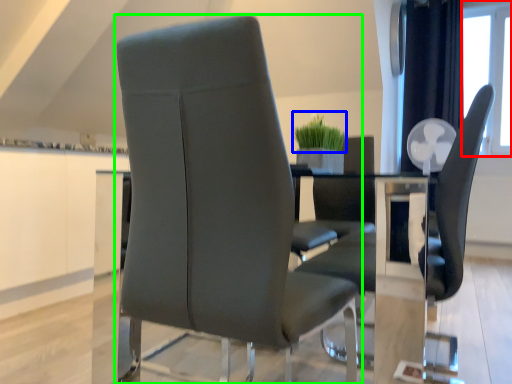
Question: Which object is positioned farthest from window screen (highlighted by a red box)? Select from plant (highlighted by a blue box) and chair (highlighted by a green box).

Choices:
 (A) plant
 (B) chair

Answer: (B)